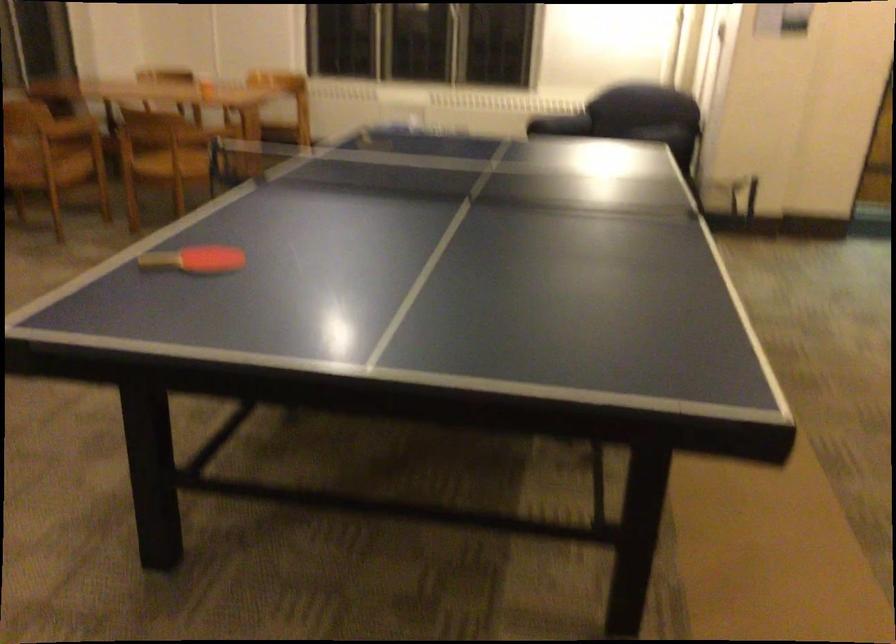
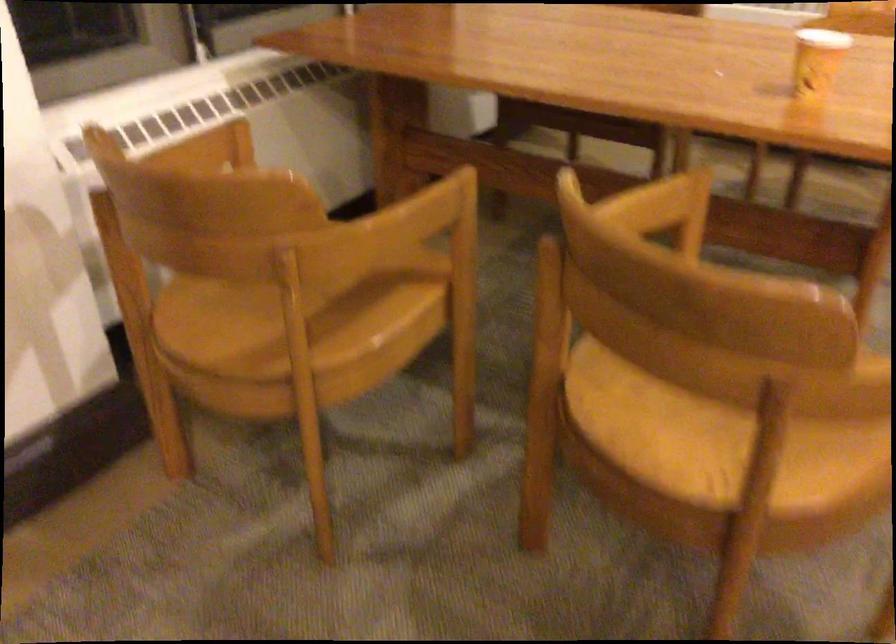
Where in the second image is the point corresponding to the point at 176,174 from the first image?

(704, 433)